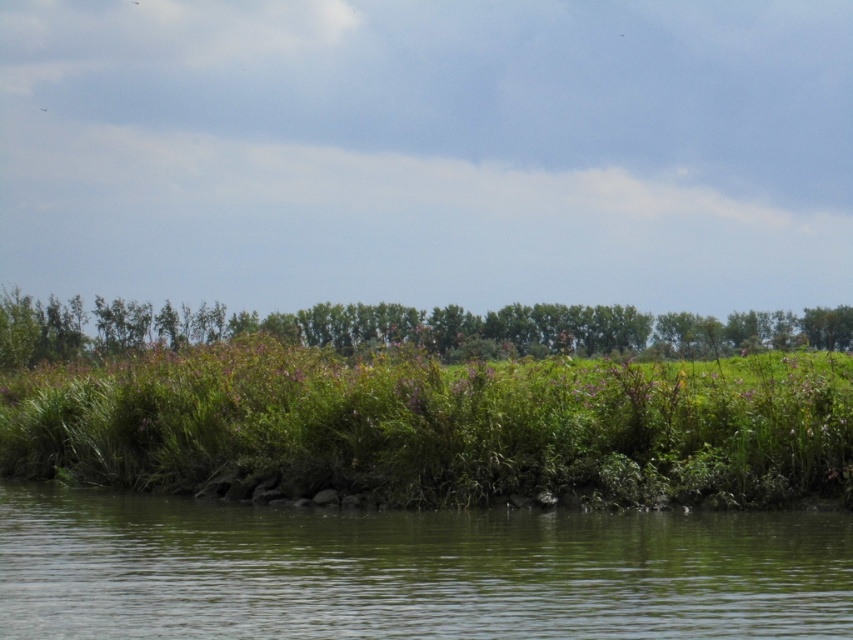
Which is above, green smooth water at lower center or green leafy trees at upper center?

green leafy trees at upper center

Which is below, green smooth water at lower center or green leafy trees at upper center?

green smooth water at lower center

Between point (384, 598) and point (202, 321), which one is positioned in front?

Positioned in front is point (384, 598).

The width and height of the screenshot is (853, 640). I want to click on green smooth water at lower center, so [x=410, y=570].